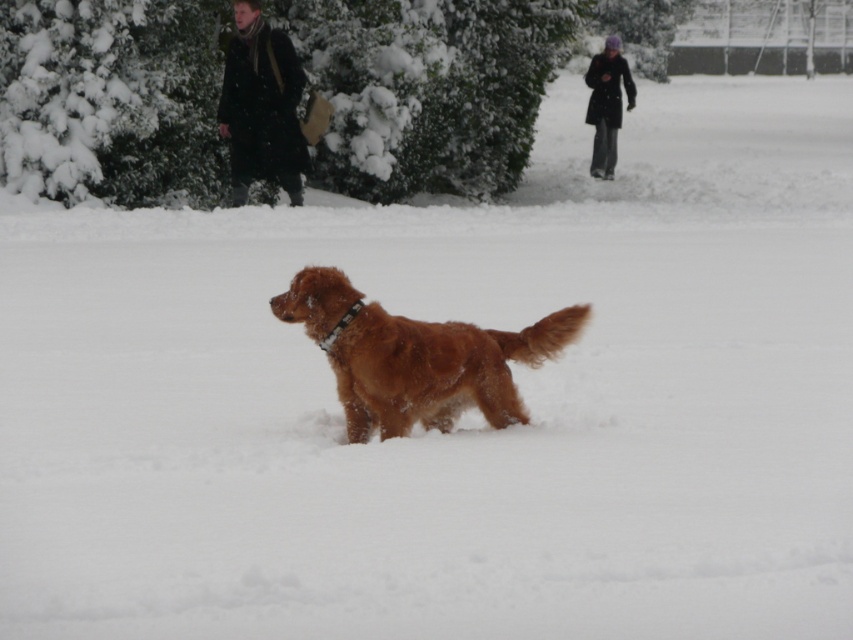
You are a photographer trying to capture both the dark brown leather coat at upper left and the dark gray wool coat at upper right in the same frame. Which coat should you focus on first to ensure both are in focus?

You should focus on the dark brown leather coat at upper left first because it is closer to the viewer than the dark gray wool coat at upper right. By focusing on the closer object, the further one will also be in focus due to the depth of field.

You are a photographer trying to capture a photo of the brown furry dog at center and the dark brown leather coat at upper left. You want to ensure both are in the frame. Based on their positions, which object is closer to the left edge of the photo?

The dark brown leather coat at upper left is closer to the left edge of the photo since the brown furry dog at center is positioned on the right side of it.